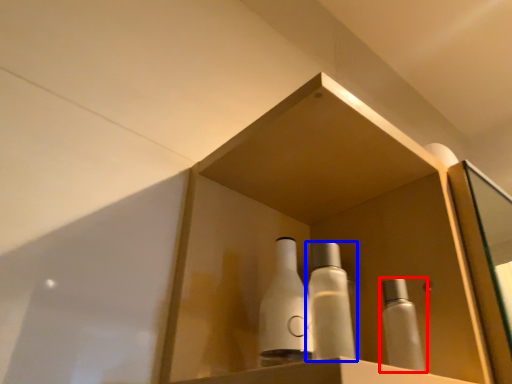
Question: Which object is further to the camera taking this photo, bottle (highlighted by a red box) or bottle (highlighted by a blue box)?

Choices:
 (A) bottle
 (B) bottle

Answer: (A)